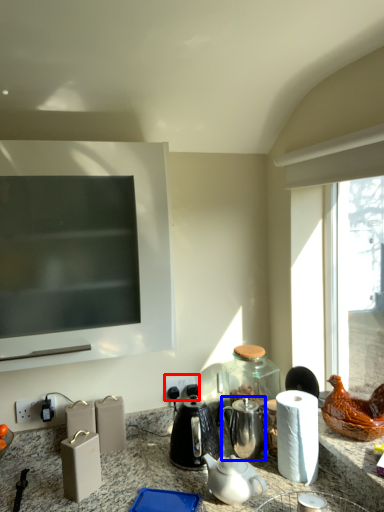
Question: Which object is further to the camera taking this photo, electric outlet (highlighted by a red box) or tea pot (highlighted by a blue box)?

Choices:
 (A) electric outlet
 (B) tea pot

Answer: (A)